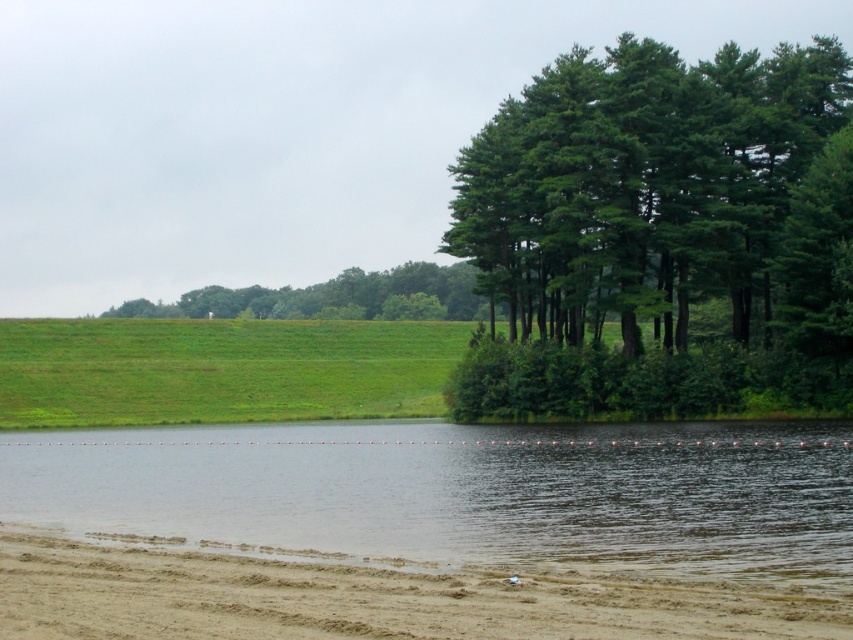
Measure the distance between green leafy trees at right and camera.

green leafy trees at right is 74.45 meters from camera.

Is point (793, 371) positioned after point (170, 304)?

No, (793, 371) is closer to viewer.

Locate an element on the screen. The height and width of the screenshot is (640, 853). green leafy trees at right is located at coordinates (662, 234).

Which of these two, clear water at lower center or green leafy tree at center, stands shorter?

Standing shorter between the two is clear water at lower center.

Does clear water at lower center have a greater width compared to green leafy tree at center?

Incorrect, clear water at lower center's width does not surpass green leafy tree at center's.

Between point (381, 497) and point (213, 294), which one is positioned behind?

The point (213, 294) is behind.

You are a GUI agent. You are given a task and a screenshot of the screen. Output one action in this format:
    pyautogui.click(x=<x>, y=<y>)
    Task: Click on the clear water at lower center
    The image size is (853, 640).
    Given the screenshot: What is the action you would take?
    [x=462, y=492]

Can you confirm if clear water at lower center is positioned below brown sandy dirt track at lower left?

Indeed, clear water at lower center is positioned under brown sandy dirt track at lower left.

Between point (770, 477) and point (637, 618), which one is positioned in front?

Positioned in front is point (637, 618).

Identify the location of clear water at lower center. The height and width of the screenshot is (640, 853). (462, 492).